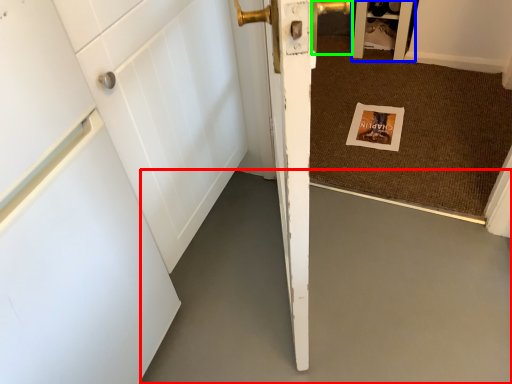
Question: Which object is the closest to the concrete (highlighted by a red box)? Choose among these: cabinetry (highlighted by a blue box) or door handle (highlighted by a green box).

Choices:
 (A) cabinetry
 (B) door handle

Answer: (A)